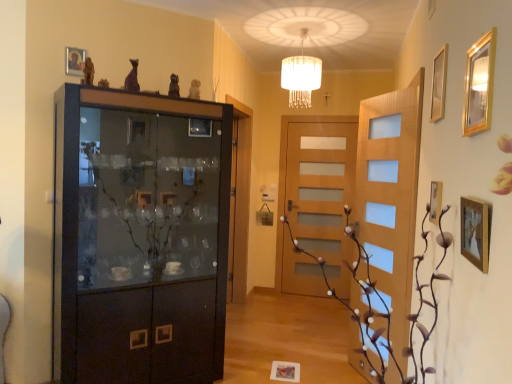
Question: Considering the positions of brown textured plant at center and wooden picture frame at right, positioned as the third picture frame in right-to-left order, in the image, is brown textured plant at center bigger or smaller than wooden picture frame at right, positioned as the third picture frame in right-to-left order,?

Choices:
 (A) small
 (B) big

Answer: (B)

Question: Considering the relative positions of brown textured plant at center and wooden picture frame at right, positioned as the third picture frame in right-to-left order, in the image provided, is brown textured plant at center to the left or to the right of wooden picture frame at right, positioned as the third picture frame in right-to-left order,?

Choices:
 (A) left
 (B) right

Answer: (A)

Question: Which object is the closest to the matte purple statue at upper center, the first art positioned from the front?

Choices:
 (A) wooden picture frame at upper left, placed as the first picture frame when sorted from top to bottom
 (B) matte black cabinet at left
 (C) satin gold statue at upper center, the second art when ordered from front to back
 (D) wooden picture frame at lower center, the first picture frame in the bottom-to-top sequence
 (E) wooden picture frame at right, arranged as the second picture frame when ordered from the bottom

Answer: (C)

Question: Which of these objects is positioned farthest from the satin gold statue at upper center, the second art when ordered from front to back?

Choices:
 (A) gold metallic picture frame at upper right, marked as the first picture frame in a right-to-left arrangement
 (B) wooden picture frame at lower center, which is the 1th picture frame from back to front
 (C) gold-framed mirror at upper right, which appears as the fourth picture frame when viewed from the back
 (D) brown textured plant at center
 (E) wooden picture frame at upper left, which appears as the fifth picture frame when viewed from the right

Answer: (B)